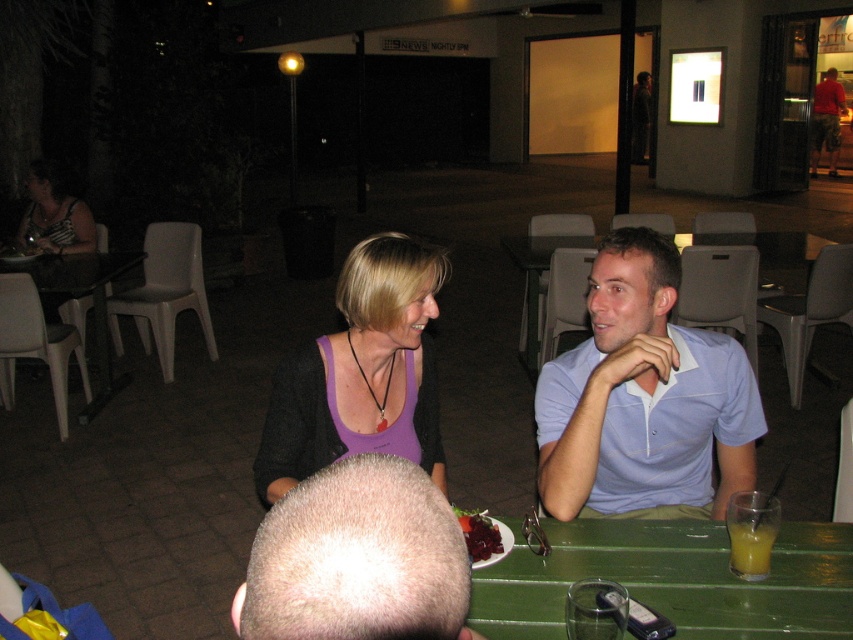
Who is shorter, wooden table at left or striped fabric dress at upper left?

striped fabric dress at upper left

Measure the distance between wooden table at left and striped fabric dress at upper left.

wooden table at left and striped fabric dress at upper left are 17.30 inches apart.

Which is behind, point (103, 400) or point (90, 232)?

The point (90, 232) is more distant.

The height and width of the screenshot is (640, 853). In order to click on wooden table at left in this screenshot , I will do `click(91, 301)`.

What do you see at coordinates (611, 358) in the screenshot?
I see `purple fabric shirt at center` at bounding box center [611, 358].

Looking at this image, is purple fabric shirt at center below striped fabric dress at upper left?

Correct, purple fabric shirt at center is located below striped fabric dress at upper left.

Who is more distant from viewer, (537, 392) or (67, 246)?

Point (67, 246)

The height and width of the screenshot is (640, 853). In order to click on purple fabric shirt at center in this screenshot , I will do `click(611, 358)`.

Is the position of purple fabric shirt at center less distant than that of smooth glossy red plate at center?

That is False.

Is purple fabric shirt at center to the right of smooth glossy red plate at center from the viewer's perspective?

→ Indeed, purple fabric shirt at center is positioned on the right side of smooth glossy red plate at center.

Where is `purple fabric shirt at center`? purple fabric shirt at center is located at coordinates (611, 358).

At what (x,y) coordinates should I click in order to perform the action: click on purple fabric shirt at center. Please return your answer as a coordinate pair (x, y). The width and height of the screenshot is (853, 640). Looking at the image, I should click on (611, 358).